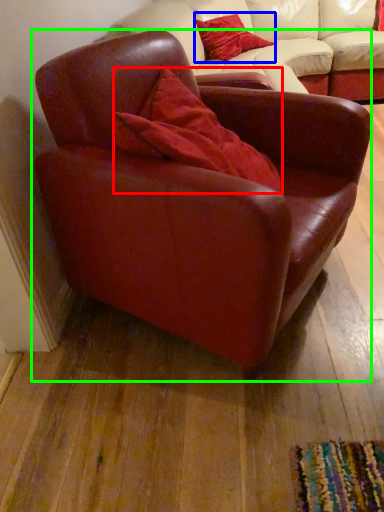
Question: Which is nearer to the pillow (highlighted by a red box)? pillow (highlighted by a blue box) or chair (highlighted by a green box).

Choices:
 (A) pillow
 (B) chair

Answer: (B)